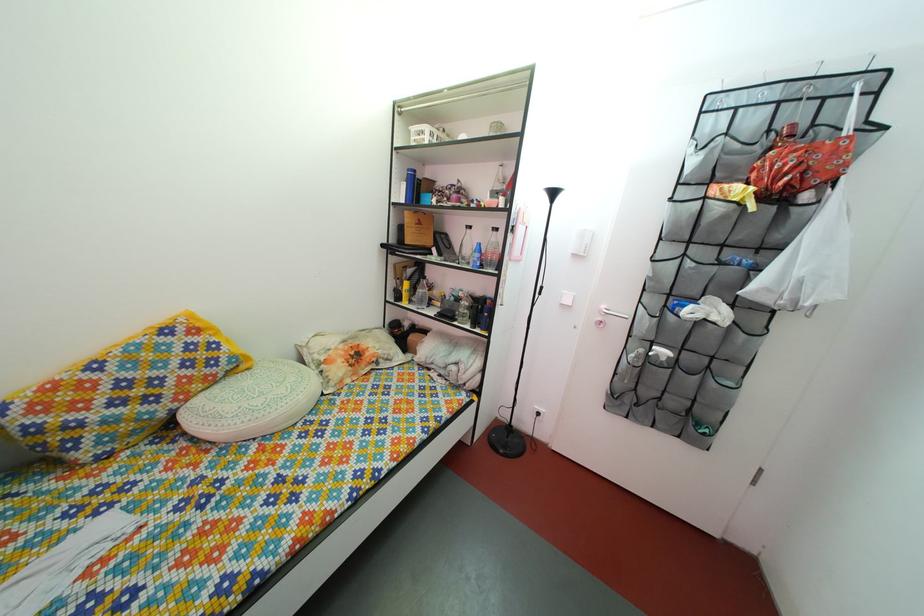
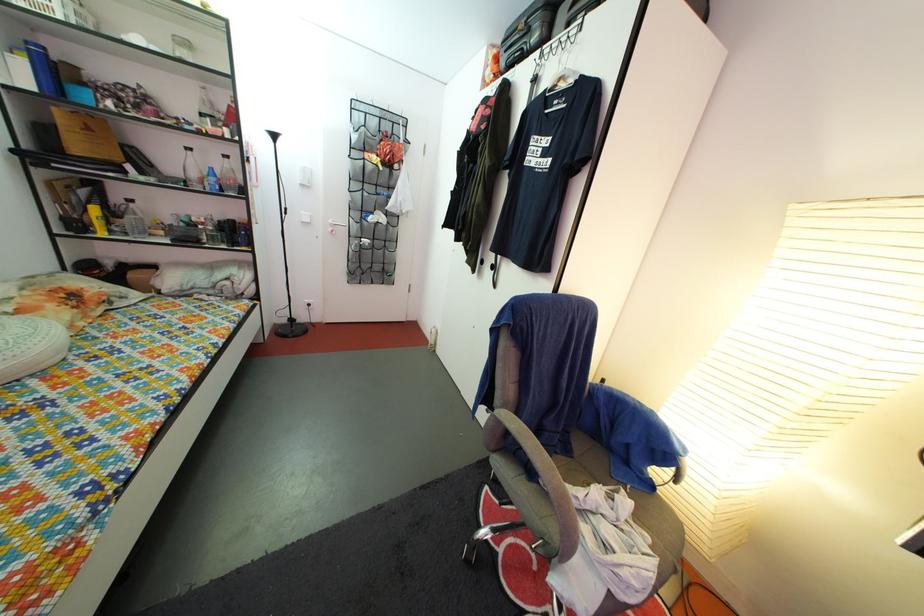
Locate, in the second image, the point that corresponds to [417,179] in the first image.

(37, 51)